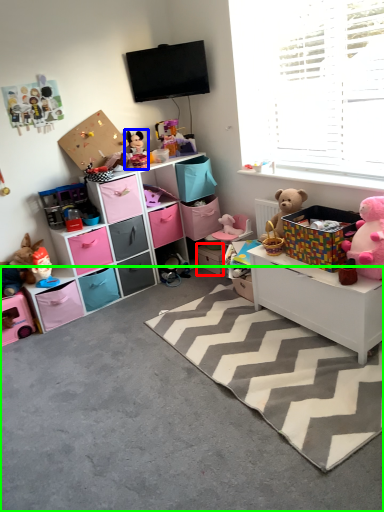
Question: Considering the real-world distances, which object is farthest from storage box (highlighted by a red box)? toy (highlighted by a blue box) or concrete (highlighted by a green box)?

Choices:
 (A) toy
 (B) concrete

Answer: (B)